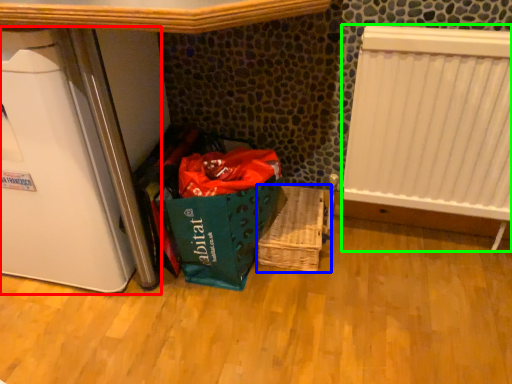
Question: Based on their relative distances, which object is farther from appliance (highlighted by a red box)? Choose from basket (highlighted by a blue box) and radiator (highlighted by a green box).

Choices:
 (A) basket
 (B) radiator

Answer: (B)